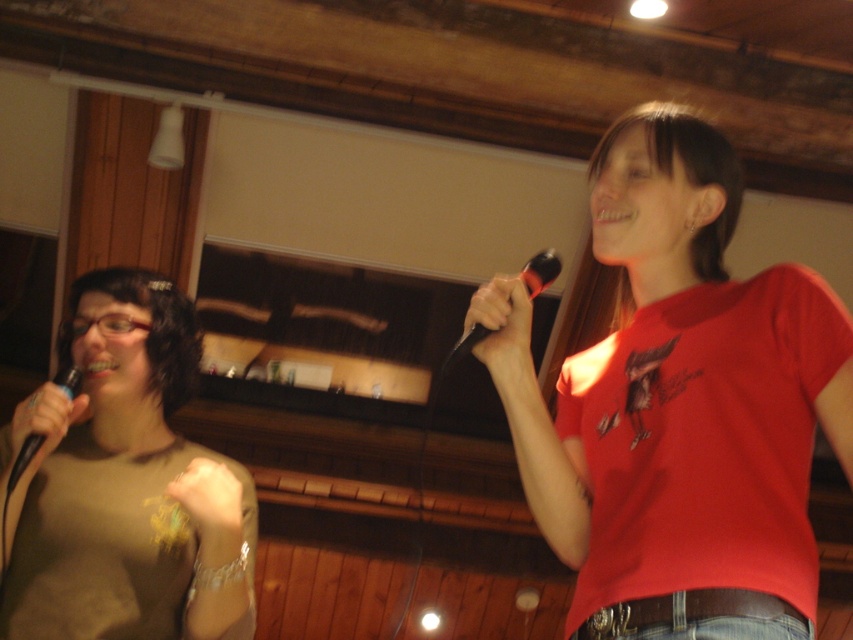
Question: Among these objects, which one is farthest from the camera?

Choices:
 (A) red matte shirt at center
 (B) black rubber microphone at upper right
 (C) matte brown shirt at left

Answer: (C)

Question: Which point is closer to the camera?

Choices:
 (A) (550, 269)
 (B) (152, 291)

Answer: (A)

Question: Does red matte shirt at center appear on the left side of matte brown shirt at left?

Choices:
 (A) no
 (B) yes

Answer: (A)

Question: Is matte brown shirt at left to the right of black rubber microphone at upper right from the viewer's perspective?

Choices:
 (A) yes
 (B) no

Answer: (B)

Question: Among these objects, which one is farthest from the camera?

Choices:
 (A) black rubber microphone at upper right
 (B) red matte shirt at center

Answer: (A)

Question: Does red matte shirt at center have a larger size compared to matte black microphone at left?

Choices:
 (A) yes
 (B) no

Answer: (A)